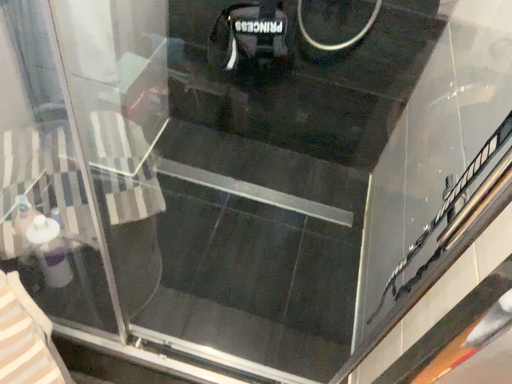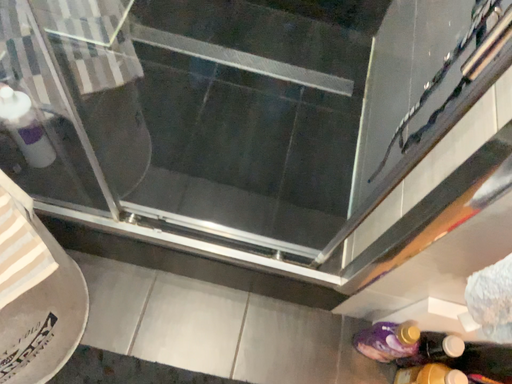
Question: Which way did the camera rotate in the video?

Choices:
 (A) rotated upward
 (B) rotated downward

Answer: (B)